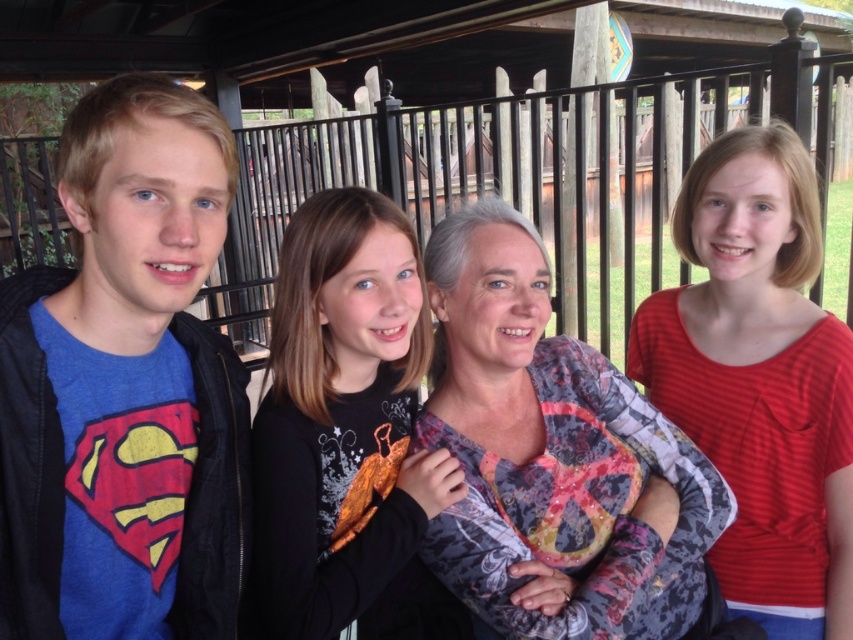
You are trying to locate the printed fabric blouse at center and the red striped shirt at right in the image. Based on their positions, which one is closer to the left side of the scene?

The printed fabric blouse at center is closer to the left side of the scene because it is positioned to the left of the red striped shirt at right.